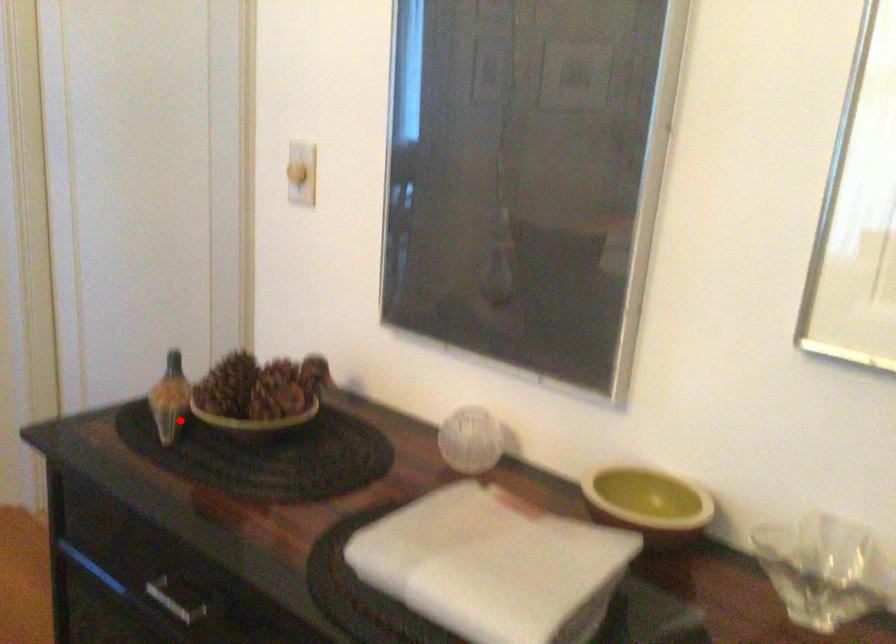
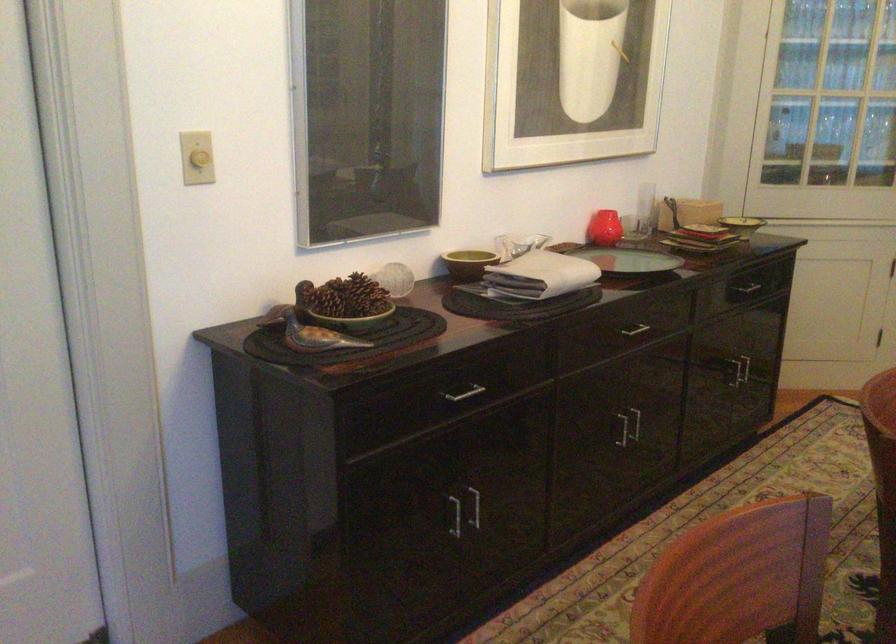
Question: A red point is marked in image1. In image2, is the corresponding 3D point closer to the camera or farther? Reply with the corresponding letter.

Choices:
 (A) The corresponding 3D point is closer.
 (B) The corresponding 3D point is farther.

Answer: (B)